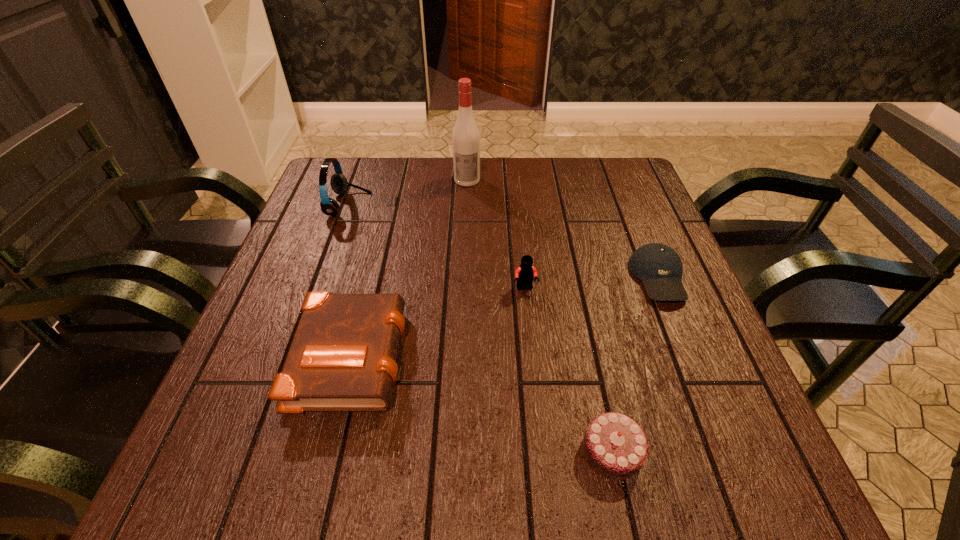
This screenshot has height=540, width=960. I want to click on empty space between the fourth object from right to left and the baseball cap, so click(563, 229).

Identify the location of vacant point located between the nearest object and the fourth object from right to left. This screenshot has width=960, height=540. (540, 315).

The image size is (960, 540). In order to click on free spot between the second object from right to left and the baseball cap in this screenshot , I will do `click(636, 364)`.

You are a GUI agent. You are given a task and a screenshot of the screen. Output one action in this format:
    pyautogui.click(x=<x>, y=<y>)
    Task: Click on the vacant area that lies between the fourth object from left to right and the fifth object from left to right
    This screenshot has width=960, height=540.
    Given the screenshot: What is the action you would take?
    pyautogui.click(x=568, y=370)

Locate an element on the screen. free point between the nearest object and the headset is located at coordinates (480, 328).

Find the location of a particular element. unoccupied position between the tallest object and the third tallest object is located at coordinates (496, 234).

The height and width of the screenshot is (540, 960). I want to click on free space between the rightmost object and the second object from right to left, so click(x=636, y=364).

Find the location of a particular element. vacant space that is in between the second object from right to left and the Bible is located at coordinates (482, 402).

Locate an element on the screen. Image resolution: width=960 pixels, height=540 pixels. vacant area that lies between the Bible and the chocolate cake is located at coordinates (482, 402).

Identify the location of empty space that is in between the Bible and the rightmost object. The height and width of the screenshot is (540, 960). click(x=505, y=315).